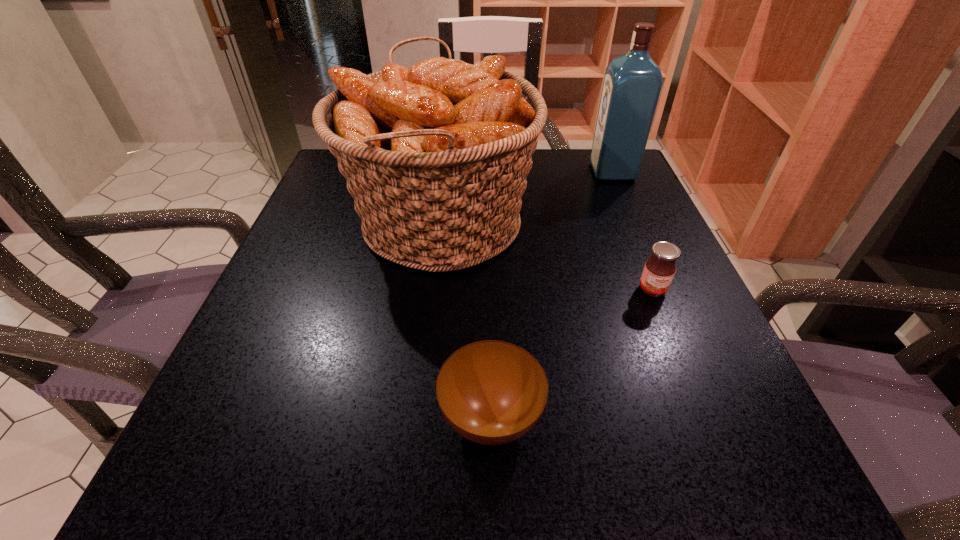
Locate an element on the screen. liquor is located at coordinates (632, 84).

I want to click on basket, so click(436, 155).

Image resolution: width=960 pixels, height=540 pixels. Identify the location of jam. (659, 270).

Locate an element on the screen. The width and height of the screenshot is (960, 540). the nearest object is located at coordinates (491, 392).

Where is `bowl`? The height and width of the screenshot is (540, 960). bowl is located at coordinates point(491,392).

Find the location of `vacant space situated 0.070m on the flat label side of the liquor`. vacant space situated 0.070m on the flat label side of the liquor is located at coordinates (563, 172).

Image resolution: width=960 pixels, height=540 pixels. What are the coordinates of `vacant region located on the flat label side of the liquor` in the screenshot? It's located at (500, 172).

This screenshot has height=540, width=960. I want to click on free region located 0.060m on the flat label side of the liquor, so click(x=566, y=172).

Locate an element on the screen. Image resolution: width=960 pixels, height=540 pixels. vacant space located 0.080m on the right of the basket is located at coordinates (574, 223).

Where is `free point located 0.310m on the label side of the jam`? This screenshot has height=540, width=960. free point located 0.310m on the label side of the jam is located at coordinates (733, 490).